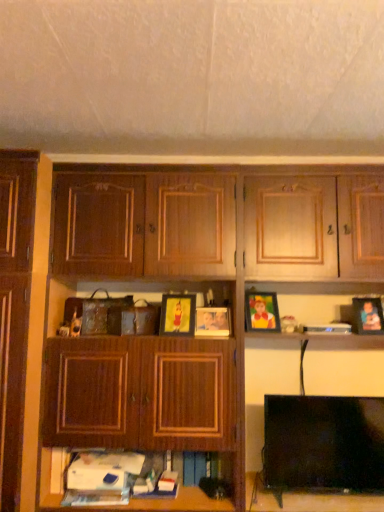
Question: From the image's perspective, does wooden cabinet at center appear higher than matte wooden picture frame at center, which is the 2th picture frame in left-to-right order?

Choices:
 (A) yes
 (B) no

Answer: (B)

Question: Does wooden cabinet at center have a lesser width compared to matte wooden picture frame at center, which is the 2th picture frame in left-to-right order?

Choices:
 (A) no
 (B) yes

Answer: (A)

Question: Does wooden cabinet at center lie behind matte wooden picture frame at center, which is the 2th picture frame in left-to-right order?

Choices:
 (A) yes
 (B) no

Answer: (B)

Question: Can matte wooden picture frame at center, which is the 2th picture frame in left-to-right order, be found inside wooden cabinet at center?

Choices:
 (A) yes
 (B) no

Answer: (A)

Question: From a real-world perspective, is wooden cabinet at center beneath matte wooden picture frame at center, acting as the third picture frame starting from the right?

Choices:
 (A) no
 (B) yes

Answer: (B)

Question: Relative to matte plastic picture frame at center, marked as the third picture frame in a left-to-right arrangement, is black plastic book at upper right in front or behind?

Choices:
 (A) behind
 (B) front

Answer: (B)

Question: From a real-world perspective, relative to matte plastic picture frame at center, which is counted as the 2th picture frame, starting from the right, is black plastic book at upper right vertically above or below?

Choices:
 (A) below
 (B) above

Answer: (A)

Question: Do you think black plastic book at upper right is within matte plastic picture frame at center, which is counted as the 2th picture frame, starting from the right, or outside of it?

Choices:
 (A) inside
 (B) outside

Answer: (B)

Question: In terms of width, does black plastic book at upper right look wider or thinner when compared to matte plastic picture frame at center, which is counted as the 2th picture frame, starting from the right?

Choices:
 (A) thin
 (B) wide

Answer: (B)

Question: From a real-world perspective, is wooden cabinet at center physically located above or below black glossy tv at lower right?

Choices:
 (A) above
 (B) below

Answer: (A)

Question: From the image's perspective, is wooden cabinet at center positioned above or below black glossy tv at lower right?

Choices:
 (A) below
 (B) above

Answer: (B)

Question: Considering their positions, is wooden cabinet at center located in front of or behind black glossy tv at lower right?

Choices:
 (A) front
 (B) behind

Answer: (A)

Question: In the image, is wooden cabinet at center on the left side or the right side of black glossy tv at lower right?

Choices:
 (A) right
 (B) left

Answer: (B)

Question: From the image's perspective, relative to matte plastic picture frame at center, marked as the third picture frame in a left-to-right arrangement, is matte plastic picture frame at right, the first picture frame positioned from the right, above or below?

Choices:
 (A) above
 (B) below

Answer: (B)

Question: In the image, is matte plastic picture frame at right, which is counted as the fourth picture frame, starting from the left, on the left side or the right side of matte plastic picture frame at center, which is counted as the 2th picture frame, starting from the right?

Choices:
 (A) right
 (B) left

Answer: (A)